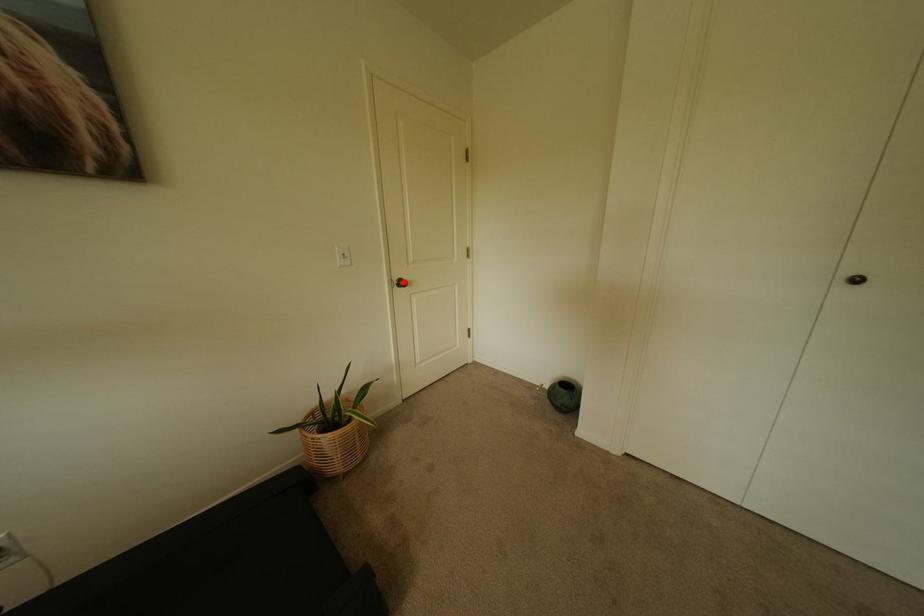
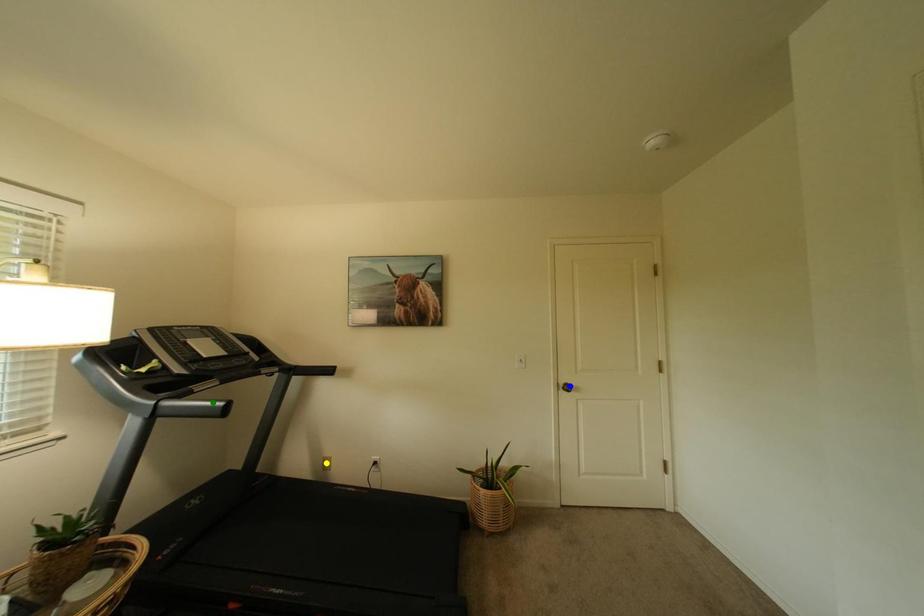
Question: I am providing you with two images of the same scene from different viewpoints. A red point is marked on the first image. You are given multiple points on the second image. Which point in image 2 represents the same 3d spot as the red point in image 1?

Choices:
 (A) blue point
 (B) yellow point
 (C) green point

Answer: (A)